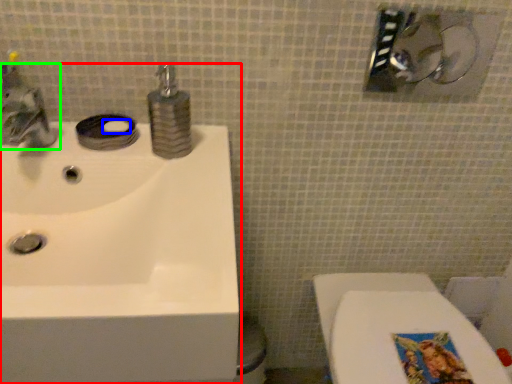
Question: Which object is the closest to the sink (highlighted by a red box)? Choose among these: soap (highlighted by a blue box) or tap (highlighted by a green box).

Choices:
 (A) soap
 (B) tap

Answer: (B)